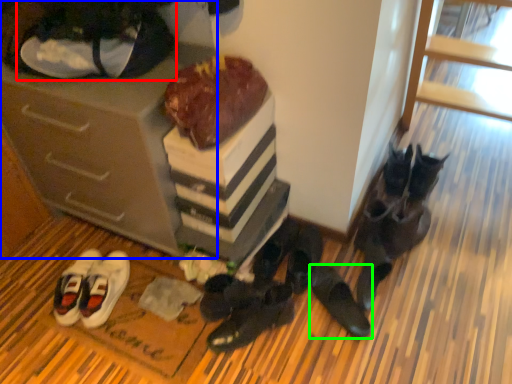
Question: Which is farther away from footwear (highlighted by a red box)? cabinetry (highlighted by a blue box) or footwear (highlighted by a green box)?

Choices:
 (A) cabinetry
 (B) footwear

Answer: (B)